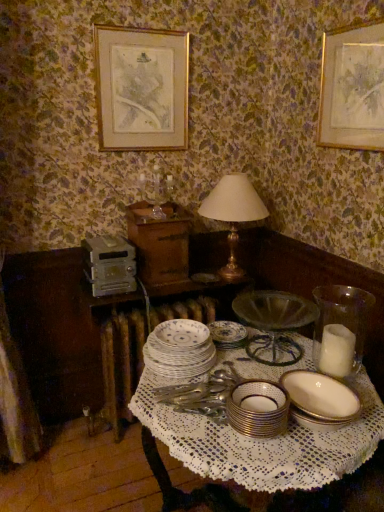
Question: From a real-world perspective, is white porcelain plates at center, which is the 3th tableware in front-to-back order, physically located above or below white porcelain table at center?

Choices:
 (A) below
 (B) above

Answer: (B)

Question: Is white porcelain plates at center, the third tableware viewed from the right, wider or thinner than white porcelain table at center?

Choices:
 (A) thin
 (B) wide

Answer: (A)

Question: Considering the real-world distances, which object is farthest from the gold-framed print at upper center?

Choices:
 (A) white porcelain table at center
 (B) gold metallic bowl at center, which ranks as the 2th tableware in left-to-right order
 (C) porcelain plate at center
 (D) gold metallic table lamp at center
 (E) white porcelain table at center

Answer: (B)

Question: Which of these objects is positioned closest to the clear glass candle holder at upper center?

Choices:
 (A) white porcelain table at center
 (B) white porcelain plates at center, placed as the first tableware when sorted from back to front
 (C) gold-framed print at upper center
 (D) gold metallic bowl at center, marked as the 1th tableware in a front-to-back arrangement
 (E) white porcelain table at center

Answer: (C)